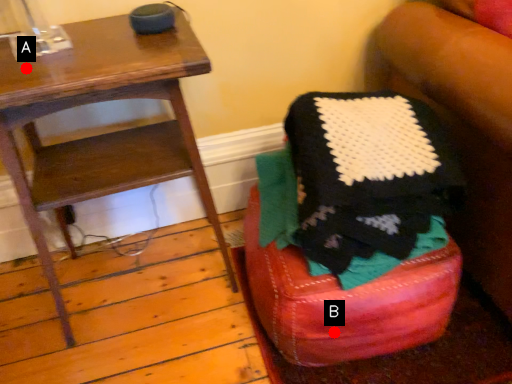
Question: Two points are circled on the image, labeled by A and B beside each circle. Which point is closer to the camera?

Choices:
 (A) A is closer
 (B) B is closer

Answer: (A)